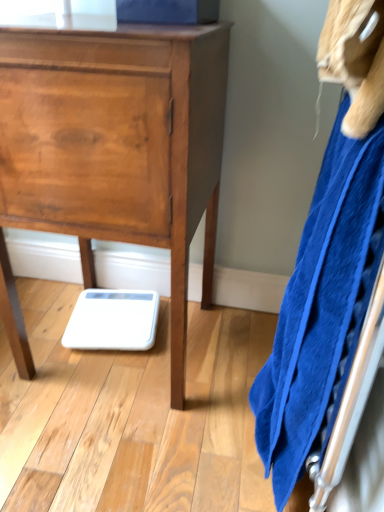
What are the coordinates of `blue soft towel at right` in the screenshot? It's located at (322, 309).

The image size is (384, 512). Describe the element at coordinates (322, 309) in the screenshot. I see `blue soft towel at right` at that location.

What do you see at coordinates (113, 151) in the screenshot? Image resolution: width=384 pixels, height=512 pixels. I see `wooden chest of drawers at center` at bounding box center [113, 151].

Where is `wooden chest of drawers at center`? wooden chest of drawers at center is located at coordinates (113, 151).

This screenshot has width=384, height=512. Find the location of `blue soft towel at right`. blue soft towel at right is located at coordinates (322, 309).

Which is more to the left, wooden chest of drawers at center or blue soft towel at right?

wooden chest of drawers at center is more to the left.

Is wooden chest of drawers at center behind blue soft towel at right?

That is True.

Is point (28, 204) closer or farther from the camera than point (342, 357)?

Point (28, 204).

From the image's perspective, between wooden chest of drawers at center and blue soft towel at right, who is located below?

blue soft towel at right is shown below in the image.

From a real-world perspective, who is located lower, wooden chest of drawers at center or blue soft towel at right?

wooden chest of drawers at center.

Considering the sizes of wooden chest of drawers at center and blue soft towel at right in the image, is wooden chest of drawers at center wider or thinner than blue soft towel at right?

Clearly, wooden chest of drawers at center has more width compared to blue soft towel at right.

Who is shorter, wooden chest of drawers at center or blue soft towel at right?

wooden chest of drawers at center is shorter.

Is wooden chest of drawers at center bigger or smaller than blue soft towel at right?

In the image, wooden chest of drawers at center appears to be larger than blue soft towel at right.

From the picture: Is wooden chest of drawers at center not inside blue soft towel at right?

wooden chest of drawers at center is positioned outside blue soft towel at right.

Is wooden chest of drawers at center touching blue soft towel at right?

wooden chest of drawers at center is not next to blue soft towel at right, and they're not touching.

Based on the photo, is wooden chest of drawers at center aimed at blue soft towel at right?

No, wooden chest of drawers at center is not turned towards blue soft towel at right.

How different are the orientations of wooden chest of drawers at center and blue soft towel at right in degrees?

The angular difference between wooden chest of drawers at center and blue soft towel at right is 87.4 degrees.

I want to click on the chest of drawers behind the blue soft towel at right, so click(113, 151).

From the picture: Which is more to the left, blue soft towel at right or wooden chest of drawers at center?

Positioned to the left is wooden chest of drawers at center.

Which is in front, blue soft towel at right or wooden chest of drawers at center?

blue soft towel at right is more forward.

Considering the positions of points (309, 348) and (114, 201), is point (309, 348) farther from camera compared to point (114, 201)?

No, (309, 348) is closer to viewer.

From the image's perspective, is blue soft towel at right above or below wooden chest of drawers at center?

blue soft towel at right is below wooden chest of drawers at center.

From a real-world perspective, is blue soft towel at right under wooden chest of drawers at center?

No.

In the scene shown: Considering the sizes of blue soft towel at right and wooden chest of drawers at center in the image, is blue soft towel at right wider or thinner than wooden chest of drawers at center?

In the image, blue soft towel at right appears to be more narrow than wooden chest of drawers at center.

Is blue soft towel at right taller than wooden chest of drawers at center?

Yes, blue soft towel at right is taller than wooden chest of drawers at center.

Does blue soft towel at right have a larger size compared to wooden chest of drawers at center?

Actually, blue soft towel at right might be smaller than wooden chest of drawers at center.

Would you say blue soft towel at right is inside or outside wooden chest of drawers at center?

blue soft towel at right exists outside the volume of wooden chest of drawers at center.

Would you say blue soft towel at right is a long distance from wooden chest of drawers at center?

They are positioned close to each other.

Consider the image. Is blue soft towel at right oriented towards wooden chest of drawers at center?

Yes.

How different are the orientations of blue soft towel at right and wooden chest of drawers at center in degrees?

The angular difference between blue soft towel at right and wooden chest of drawers at center is 87.4 degrees.

This screenshot has width=384, height=512. Find the location of `the chest of drawers lying behind the blue soft towel at right`. the chest of drawers lying behind the blue soft towel at right is located at coordinates click(113, 151).

At what (x,y) coordinates should I click in order to perform the action: click on bath towel in front of the wooden chest of drawers at center. Please return your answer as a coordinate pair (x, y). The width and height of the screenshot is (384, 512). Looking at the image, I should click on (322, 309).

Where is `chest of drawers below the blue soft towel at right (from a real-world perspective)`? The width and height of the screenshot is (384, 512). chest of drawers below the blue soft towel at right (from a real-world perspective) is located at coordinates (113, 151).